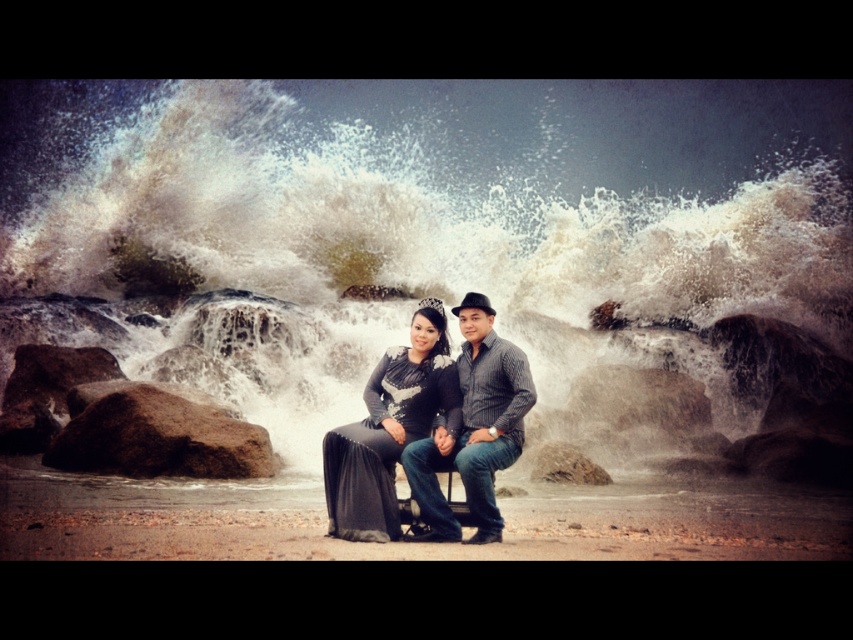
You are standing in front of the rocky shoreline scene. There are two points marked in the image. The first point is at coordinates point (372, 157) and the second point is at point (390, 470). If you want to place a small flag at the point that is closer to you, which point should you choose?

You should choose point (390, 470) because it is closer to you compared to point (372, 157) which is further away.

You are standing at the viewpoint overlooking the rocky shoreline. There is a specific point marked at coordinates point [170,109] that you want to reach. Considering your average walking speed of 1.4 meters per second, how many seconds will it take you to walk from your current position to that point?

The distance between you and point [170,109] is 146.40 meters. At a walking speed of 1.4 meters per second, it will take approximately 104.57 seconds to reach the point.

You are a photographer trying to capture the two subjects on the bench without the water in the foreground blocking them. Based on their positions, can you adjust your camera angle to ensure the matte black dress at center and white textured water at center are both visible clearly?

The matte black dress at center is behind the white textured water at center, so adjusting the camera angle slightly to either side or lowering the camera position might allow both subjects and the water to be visible without obstruction.